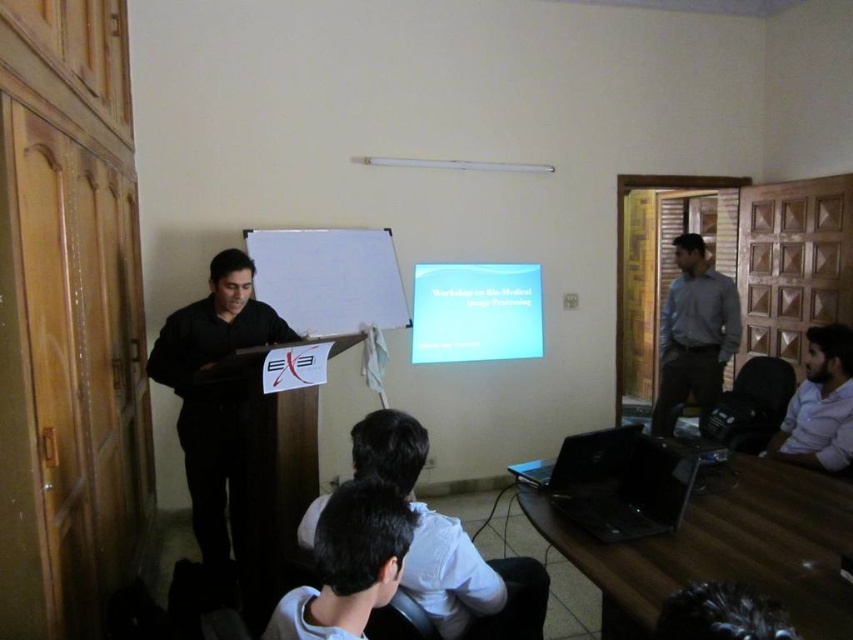
You are sitting in a classroom and need to locate two laptops. The black matte laptop at center and the black plastic laptop at lower right. Which one is positioned to the left?

The black matte laptop at center is positioned to the left of the black plastic laptop at lower right.

You are sitting in the classroom and want to move from your current position to the podium. You notice two points marked in the room. Which point, point [621,502] or point [807,388], is closer to the podium?

Point [621,502] is in front of point [807,388], so it is closer to the podium.

What object is located at the coordinates point (635, 496) in the classroom scene?

The point (635, 496) indicates a black plastic laptop at lower right.